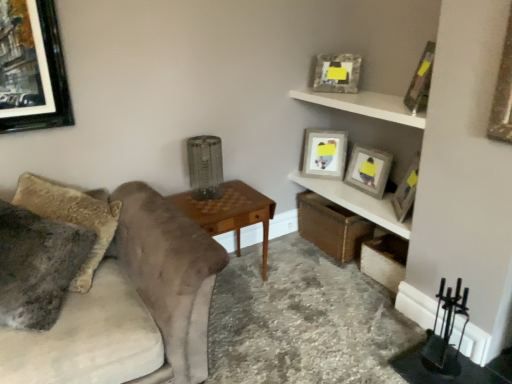
Question: Can you confirm if wooden shelf at upper right, positioned as the 1th shelf in bottom-to-top order, is shorter than wooden picture frame at upper right, which appears as the second picture frame when viewed from the front?

Choices:
 (A) no
 (B) yes

Answer: (B)

Question: Is wooden shelf at upper right, positioned as the 1th shelf in bottom-to-top order, positioned with its back to wooden picture frame at upper right, which appears as the second picture frame when viewed from the front?

Choices:
 (A) no
 (B) yes

Answer: (A)

Question: Considering the relative sizes of wooden shelf at upper right, the 2th shelf when ordered from top to bottom, and wooden picture frame at upper right, the fourth picture frame positioned from the back, in the image provided, is wooden shelf at upper right, the 2th shelf when ordered from top to bottom, wider than wooden picture frame at upper right, the fourth picture frame positioned from the back,?

Choices:
 (A) no
 (B) yes

Answer: (B)

Question: Is wooden shelf at upper right, positioned as the 1th shelf in bottom-to-top order, smaller than wooden picture frame at upper right, the fourth picture frame positioned from the back?

Choices:
 (A) no
 (B) yes

Answer: (A)

Question: Does wooden shelf at upper right, positioned as the 1th shelf in bottom-to-top order, have a greater height compared to wooden picture frame at upper right, the fourth picture frame positioned from the back?

Choices:
 (A) yes
 (B) no

Answer: (B)

Question: Looking at their shapes, would you say wooden shelf at upper right, positioned as the 1th shelf in bottom-to-top order, is wider or thinner than fuzzy fabric pillow at left?

Choices:
 (A) wide
 (B) thin

Answer: (B)

Question: Considering the relative positions of wooden shelf at upper right, the 2th shelf when ordered from top to bottom, and fuzzy fabric pillow at left in the image provided, is wooden shelf at upper right, the 2th shelf when ordered from top to bottom, to the left or to the right of fuzzy fabric pillow at left?

Choices:
 (A) right
 (B) left

Answer: (A)

Question: Considering the positions of wooden shelf at upper right, positioned as the 1th shelf in bottom-to-top order, and fuzzy fabric pillow at left in the image, is wooden shelf at upper right, positioned as the 1th shelf in bottom-to-top order, bigger or smaller than fuzzy fabric pillow at left?

Choices:
 (A) big
 (B) small

Answer: (B)

Question: From the image's perspective, is wooden shelf at upper right, the 2th shelf when ordered from top to bottom, located above or below fuzzy fabric pillow at left?

Choices:
 (A) below
 (B) above

Answer: (B)

Question: From the image's perspective, is velvet gray couch at left above or below wooden shelf at upper right, the 2th shelf when ordered from top to bottom?

Choices:
 (A) below
 (B) above

Answer: (A)

Question: Is velvet gray couch at left wider or thinner than wooden shelf at upper right, positioned as the 1th shelf in bottom-to-top order?

Choices:
 (A) thin
 (B) wide

Answer: (B)

Question: Does point click(x=205, y=337) appear closer or farther from the camera than point click(x=303, y=180)?

Choices:
 (A) closer
 (B) farther

Answer: (A)

Question: In the image, is velvet gray couch at left positioned in front of or behind wooden shelf at upper right, positioned as the 1th shelf in bottom-to-top order?

Choices:
 (A) front
 (B) behind

Answer: (A)

Question: Considering their positions, is fuzzy fabric pillow at left located in front of or behind wooden shelf at upper right, the 2th shelf when ordered from top to bottom?

Choices:
 (A) behind
 (B) front

Answer: (B)

Question: Which is correct: fuzzy fabric pillow at left is inside wooden shelf at upper right, the 2th shelf when ordered from top to bottom, or outside of it?

Choices:
 (A) outside
 (B) inside

Answer: (A)